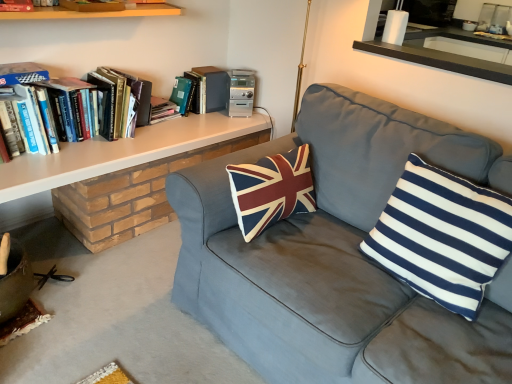
Identify the location of vacant space in front of hardcover book at upper center, the 4th book positioned from the front. (190, 124).